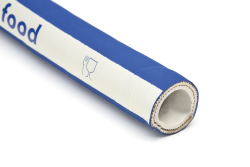
Find the location of a particular element. glass is located at coordinates (87, 67).